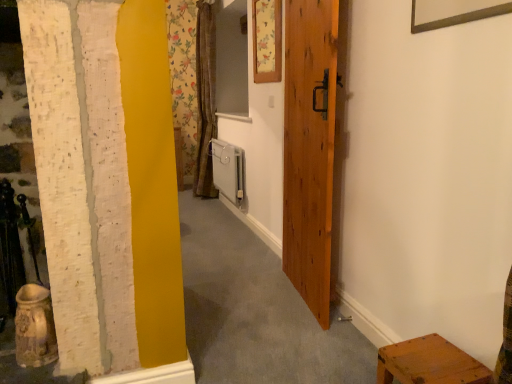
Question: Is wooden stool at lower right to the right of wooden door at center from the viewer's perspective?

Choices:
 (A) yes
 (B) no

Answer: (A)

Question: Is wooden stool at lower right shorter than wooden door at center?

Choices:
 (A) no
 (B) yes

Answer: (B)

Question: Considering the relative positions of wooden stool at lower right and wooden door at center in the image provided, is wooden stool at lower right in front of wooden door at center?

Choices:
 (A) no
 (B) yes

Answer: (B)

Question: Is wooden stool at lower right located outside wooden door at center?

Choices:
 (A) yes
 (B) no

Answer: (A)

Question: Is the position of wooden stool at lower right more distant than that of wooden door at center?

Choices:
 (A) no
 (B) yes

Answer: (A)

Question: Based on their positions, is wooden door at center located to the left or right of white plastic radiator at center?

Choices:
 (A) right
 (B) left

Answer: (A)

Question: Is wooden door at center inside the boundaries of white plastic radiator at center, or outside?

Choices:
 (A) outside
 (B) inside

Answer: (A)

Question: Is wooden door at center in front of or behind white plastic radiator at center in the image?

Choices:
 (A) behind
 (B) front

Answer: (B)

Question: Considering the positions of wooden door at center and white plastic radiator at center in the image, is wooden door at center taller or shorter than white plastic radiator at center?

Choices:
 (A) short
 (B) tall

Answer: (B)

Question: Considering the positions of white plastic radiator at center and wooden stool at lower right in the image, is white plastic radiator at center taller or shorter than wooden stool at lower right?

Choices:
 (A) short
 (B) tall

Answer: (B)

Question: Considering the positions of point (230, 182) and point (391, 377), is point (230, 182) closer or farther from the camera than point (391, 377)?

Choices:
 (A) farther
 (B) closer

Answer: (A)

Question: Is white plastic radiator at center wider or thinner than wooden stool at lower right?

Choices:
 (A) thin
 (B) wide

Answer: (A)

Question: From the image's perspective, relative to wooden stool at lower right, is white plastic radiator at center above or below?

Choices:
 (A) below
 (B) above

Answer: (B)

Question: Considering the positions of wooden stool at lower right and floral paper picture frame at upper center in the image, is wooden stool at lower right taller or shorter than floral paper picture frame at upper center?

Choices:
 (A) tall
 (B) short

Answer: (B)

Question: From the image's perspective, is wooden stool at lower right located above or below floral paper picture frame at upper center?

Choices:
 (A) below
 (B) above

Answer: (A)